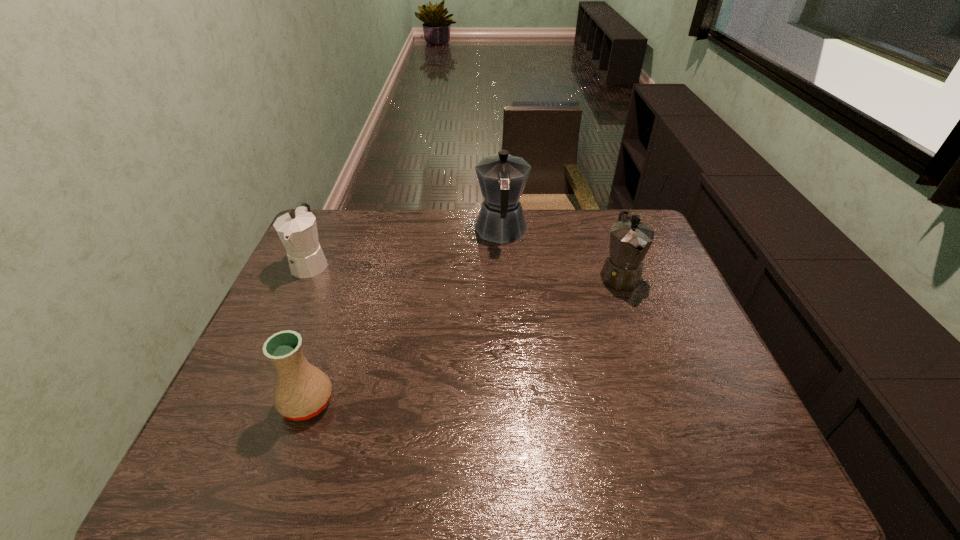
At what (x,y) coordinates should I click in order to perform the action: click on coffeepot that is the second closest to the leftmost coffeepot. Please return your answer as a coordinate pair (x, y). Looking at the image, I should click on (630, 239).

Locate which coffeepot is the closest to the rightmost coffeepot. Please provide its 2D coordinates. Your answer should be formatted as a tuple, i.e. [(x, y)], where the tuple contains the x and y coordinates of a point satisfying the conditions above.

[(502, 177)]

The height and width of the screenshot is (540, 960). I want to click on free space that satisfies the following two spatial constraints: 1. at the spout of the leftmost coffeepot; 2. on the right side of the nearest object, so click(248, 402).

Identify the location of vacant area that satisfies the following two spatial constraints: 1. at the spout of the nearest object; 2. on the left side of the leftmost coffeepot. (248, 402).